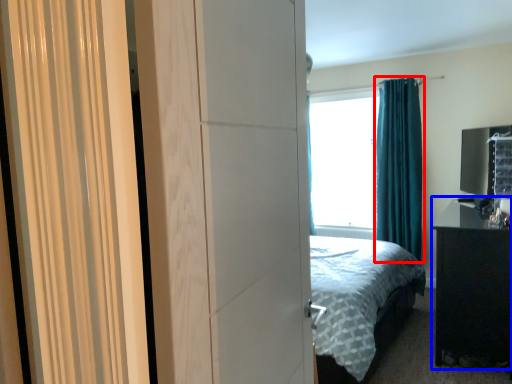
Question: Which object appears closest to the camera in this image, curtain (highlighted by a red box) or nightstand (highlighted by a blue box)?

Choices:
 (A) curtain
 (B) nightstand

Answer: (B)